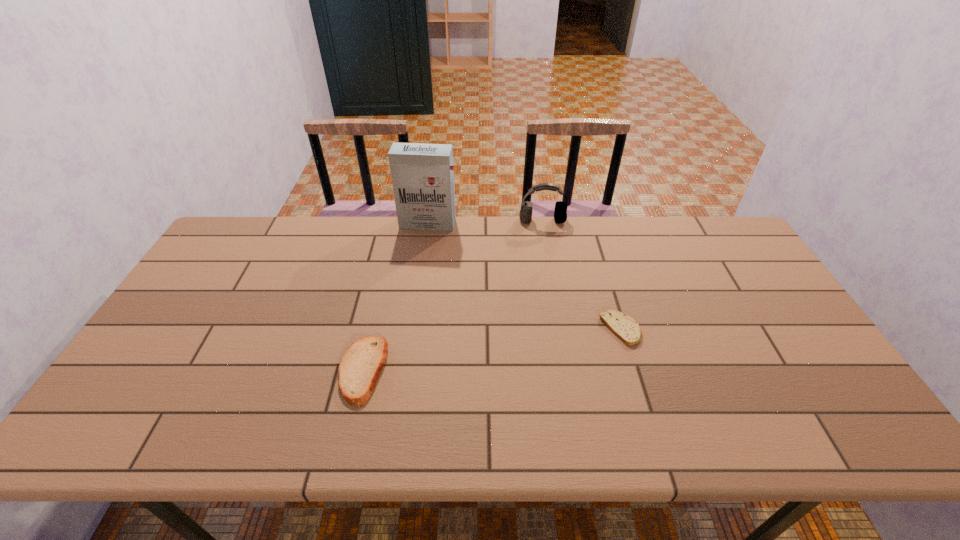
At what (x,y) coordinates should I click in order to perform the action: click on cigarette case. Please return your answer as a coordinate pair (x, y). This screenshot has width=960, height=540. Looking at the image, I should click on (422, 175).

Image resolution: width=960 pixels, height=540 pixels. I want to click on the second object from right to left, so click(560, 213).

Where is `the third shortest object`? The image size is (960, 540). the third shortest object is located at coordinates (560, 213).

This screenshot has width=960, height=540. Identify the location of the second shortest object. (360, 367).

The image size is (960, 540). Identify the location of the taller pita bread. (360, 367).

Image resolution: width=960 pixels, height=540 pixels. Find the location of `the shorter pita bread`. the shorter pita bread is located at coordinates (624, 327).

Where is `the rightmost object`? the rightmost object is located at coordinates (624, 327).

The image size is (960, 540). In order to click on vacant point located on the left of the cigarette case in this screenshot , I will do `click(377, 224)`.

In order to click on vacant point located on the headband of the third object from left to right in this screenshot , I will do `click(553, 281)`.

In order to click on free space located on the left of the third tallest object in this screenshot , I will do `click(273, 370)`.